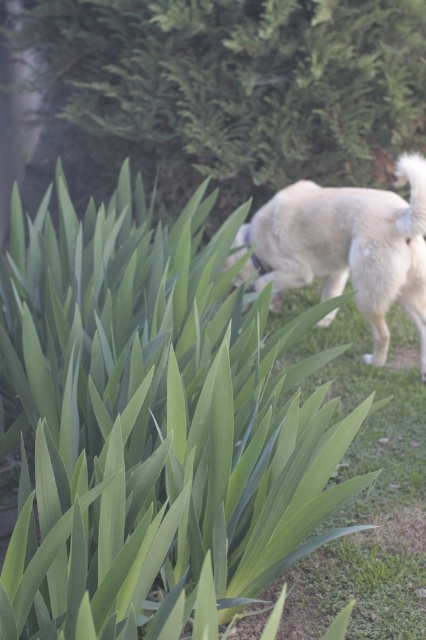
Question: Where is white fluffy dog at right located in relation to white fabric neckband at center in the image?

Choices:
 (A) right
 (B) left

Answer: (A)

Question: Does green leafy plant at upper left have a larger size compared to white fabric neckband at center?

Choices:
 (A) yes
 (B) no

Answer: (A)

Question: Is the position of white fluffy dog at right less distant than that of white fabric neckband at center?

Choices:
 (A) yes
 (B) no

Answer: (A)

Question: Which point is farther to the camera?

Choices:
 (A) green leafy plant at upper left
 (B) white fluffy dog at right
 (C) white fabric neckband at center

Answer: (A)

Question: Considering the real-world distances, which object is closest to the white fabric neckband at center?

Choices:
 (A) white fluffy dog at right
 (B) green leafy plant at upper left

Answer: (A)

Question: Estimate the real-world distances between objects in this image. Which object is farther from the green leafy plant at upper left?

Choices:
 (A) white fluffy dog at right
 (B) white fabric neckband at center

Answer: (B)